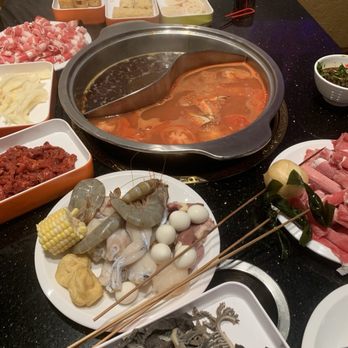
Image resolution: width=348 pixels, height=348 pixels. In order to click on green dish in this screenshot , I will do `click(203, 15)`.